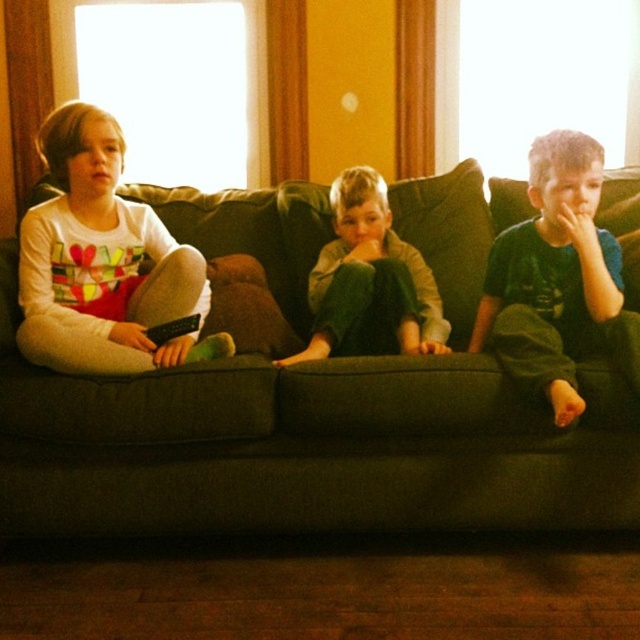
Question: Is green fabric couch at center above white soft shirt at left?

Choices:
 (A) no
 (B) yes

Answer: (A)

Question: Based on their relative distances, which object is farther from the green fabric couch at center?

Choices:
 (A) white soft shirt at left
 (B) green cotton pants at center
 (C) green cotton shirt at right

Answer: (B)

Question: Does white soft shirt at left appear under green cotton pants at center?

Choices:
 (A) no
 (B) yes

Answer: (A)

Question: Which of the following is the closest to the observer?

Choices:
 (A) (566, 292)
 (B) (42, 330)
 (C) (413, 353)

Answer: (B)

Question: Does white soft shirt at left have a greater width compared to green cotton pants at center?

Choices:
 (A) no
 (B) yes

Answer: (B)

Question: Which object appears farthest from the camera in this image?

Choices:
 (A) green fabric couch at center
 (B) green cotton pants at center
 (C) white soft shirt at left

Answer: (B)